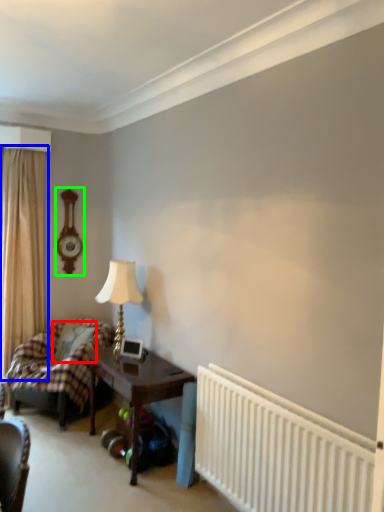
Question: Which object is the farthest from pillow (highlighted by a red box)? Choose among these: curtain (highlighted by a blue box) or clock (highlighted by a green box).

Choices:
 (A) curtain
 (B) clock

Answer: (B)